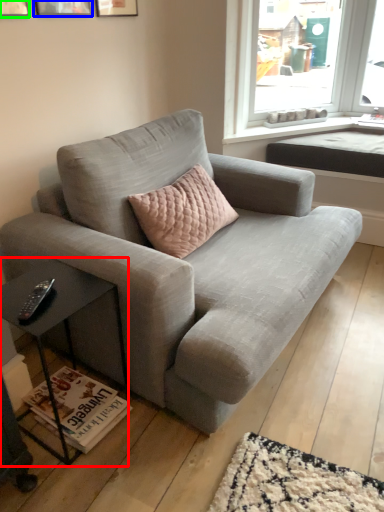
Question: Based on their relative distances, which object is nearer to table (highlighted by a red box)? Choose from picture frame (highlighted by a blue box) and picture frame (highlighted by a green box).

Choices:
 (A) picture frame
 (B) picture frame

Answer: (B)